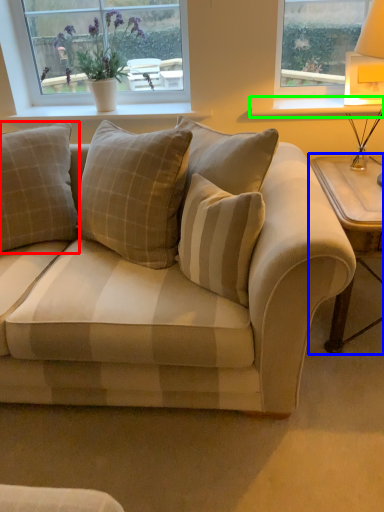
Question: Based on their relative distances, which object is nearer to pillow (highlighted by a red box)? Choose from table (highlighted by a blue box) and window sill (highlighted by a green box).

Choices:
 (A) table
 (B) window sill

Answer: (B)